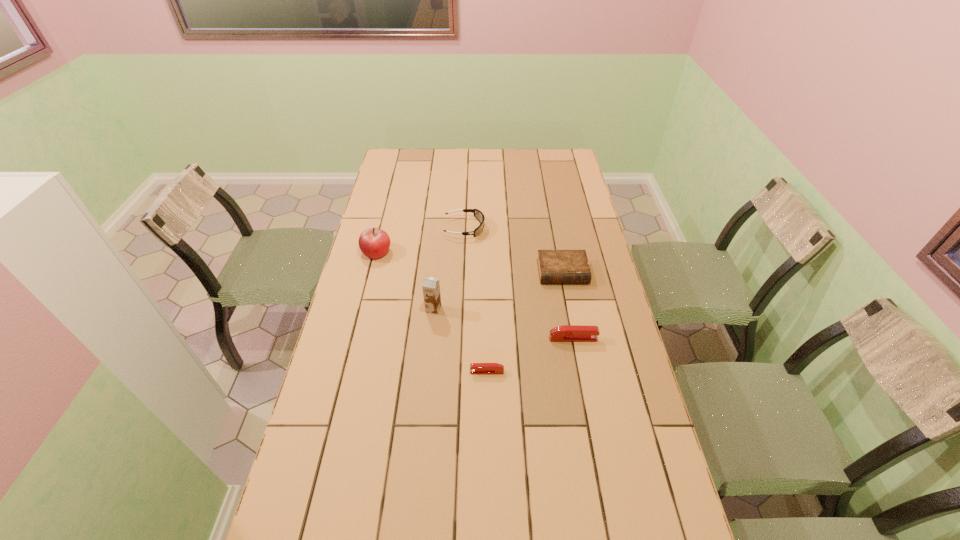
The width and height of the screenshot is (960, 540). Identify the location of the shortest object. (475, 368).

Find the location of a particular element. The height and width of the screenshot is (540, 960). the shorter stapler is located at coordinates (475, 368).

Locate an element on the screen. This screenshot has width=960, height=540. the right stapler is located at coordinates (567, 333).

Locate an element on the screen. This screenshot has width=960, height=540. the taller stapler is located at coordinates (567, 333).

Locate an element on the screen. The image size is (960, 540). the farthest object is located at coordinates (478, 214).

At what (x,y) coordinates should I click in order to perform the action: click on the fourth farthest object. Please return your answer as a coordinate pair (x, y). The width and height of the screenshot is (960, 540). Looking at the image, I should click on (431, 287).

Locate an element on the screen. The width and height of the screenshot is (960, 540). chocolate milk is located at coordinates (431, 287).

The height and width of the screenshot is (540, 960). Identify the location of diary. (554, 266).

At what (x,y) coordinates should I click in order to perform the action: click on apple. Please return your answer as a coordinate pair (x, y). This screenshot has height=540, width=960. Looking at the image, I should click on (374, 243).

Locate an element on the screen. This screenshot has height=540, width=960. the leftmost object is located at coordinates (374, 243).